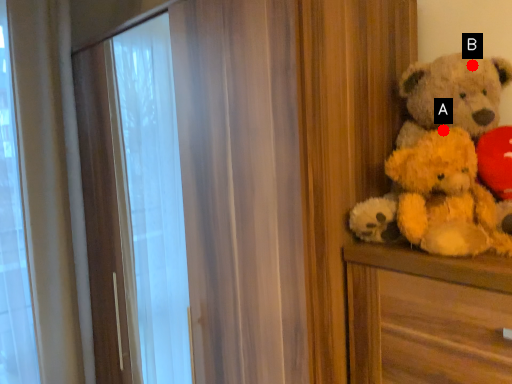
Question: Two points are circled on the image, labeled by A and B beside each circle. Which of the following is the closest to the observer?

Choices:
 (A) A is closer
 (B) B is closer

Answer: (A)